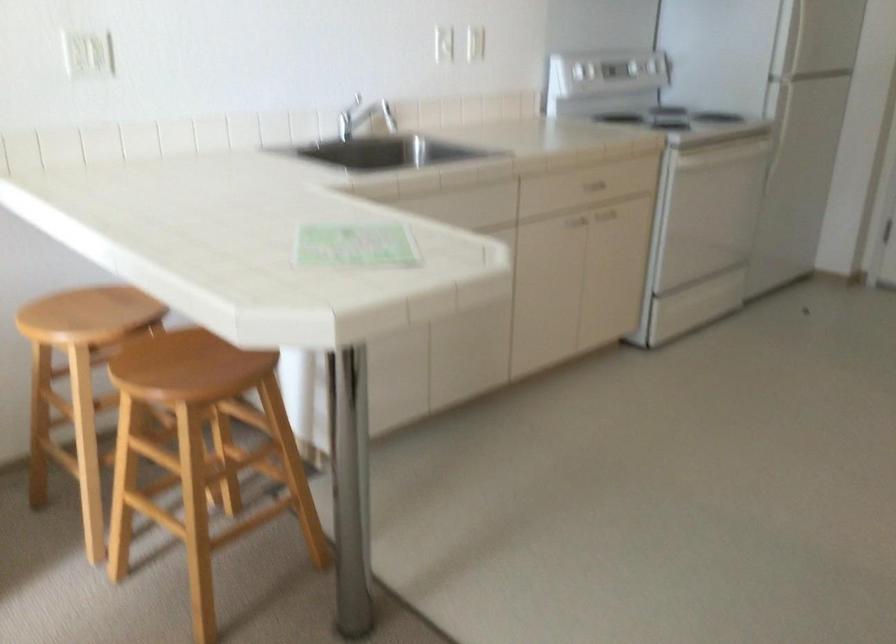
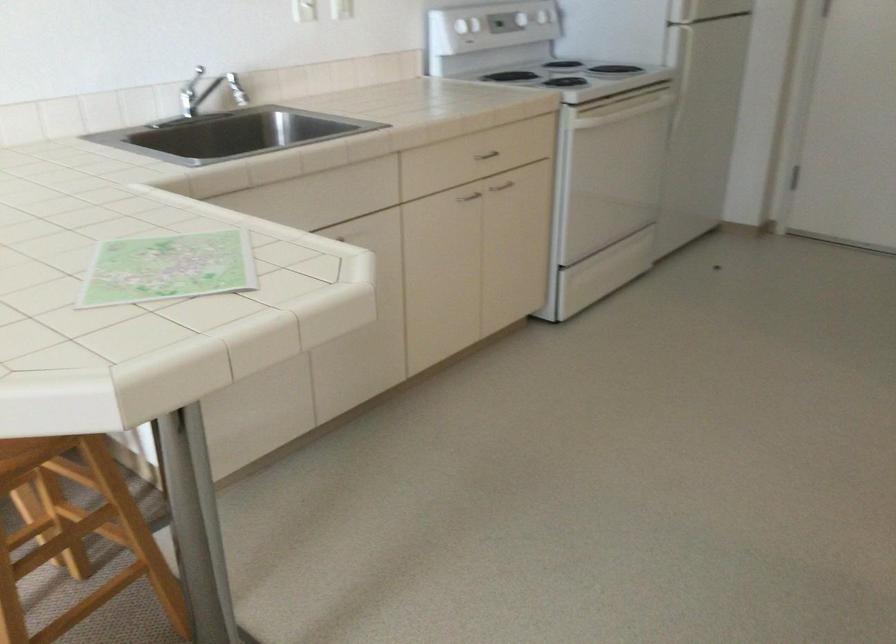
Question: The images are taken continuously from a first-person perspective. In which direction are you moving?

Choices:
 (A) Left
 (B) Right
 (C) Forward
 (D) Backward

Answer: (C)